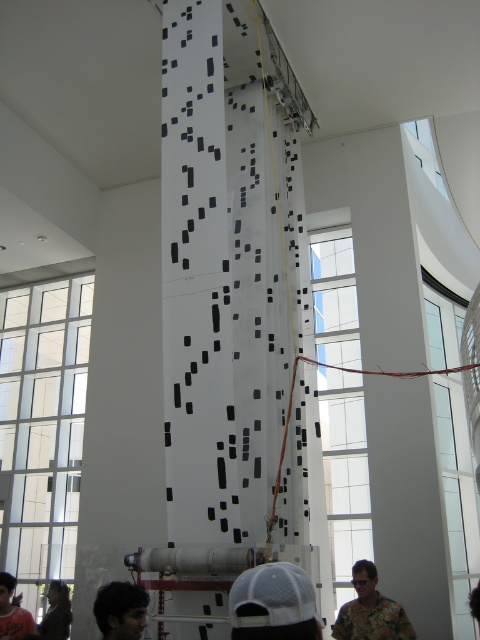
Question: Which point appears closest to the camera in this image?

Choices:
 (A) (x=195, y=340)
 (B) (x=60, y=589)
 (C) (x=13, y=582)

Answer: (A)

Question: Can you confirm if dark brown hair at lower left is positioned to the right of dark gray jacket at lower left?

Choices:
 (A) yes
 (B) no

Answer: (A)

Question: Estimate the real-world distances between objects in this image. Which object is closer to the dark brown hair at lower left?

Choices:
 (A) dark hair at lower left
 (B) hawaiian shirt at lower right
 (C) dark hair at lower right
 (D) white mesh cap at center

Answer: (B)

Question: Which point is closer to the camera taking this photo?

Choices:
 (A) (10, 609)
 (B) (477, 612)
 (C) (63, 616)
 (D) (348, 625)

Answer: (B)

Question: Does white mesh cap at center come behind dark hair at lower right?

Choices:
 (A) yes
 (B) no

Answer: (B)

Question: Is dark hair at lower left to the left of dark brown hair at lower left from the viewer's perspective?

Choices:
 (A) yes
 (B) no

Answer: (B)